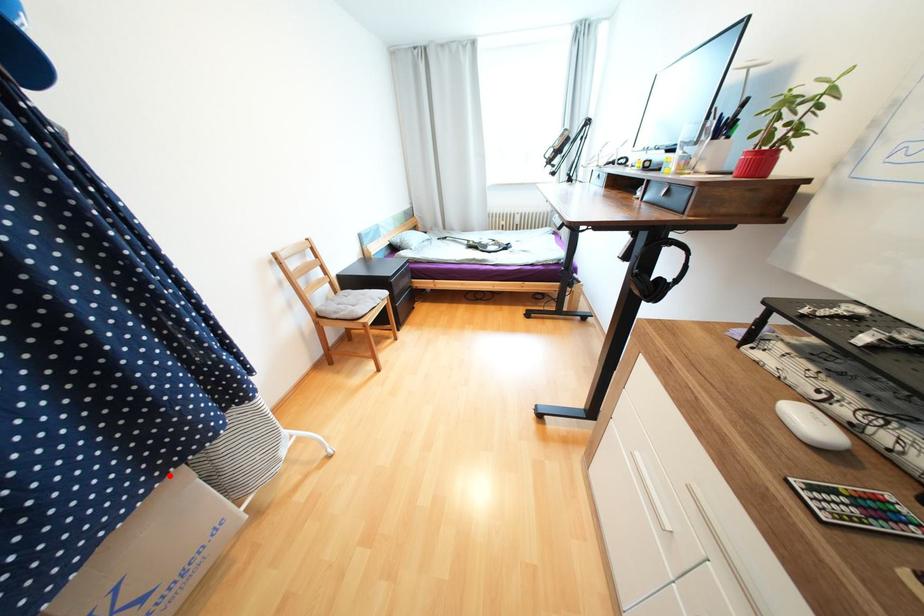
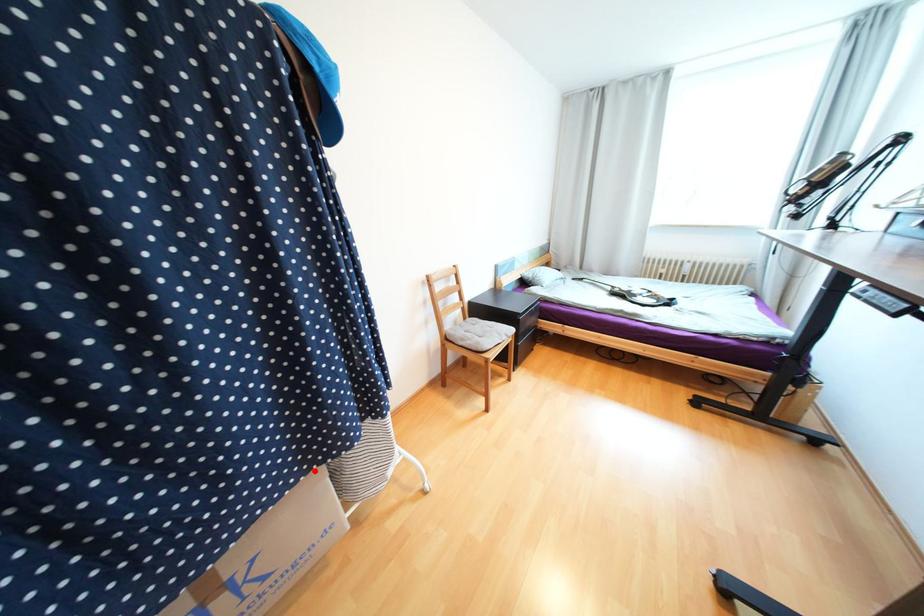
I am providing you with two images of the same scene from different viewpoints. A red point is marked on the first image and another point is marked on the second image. Do the highlighted points in image1 and image2 indicate the same real-world spot?

Yes